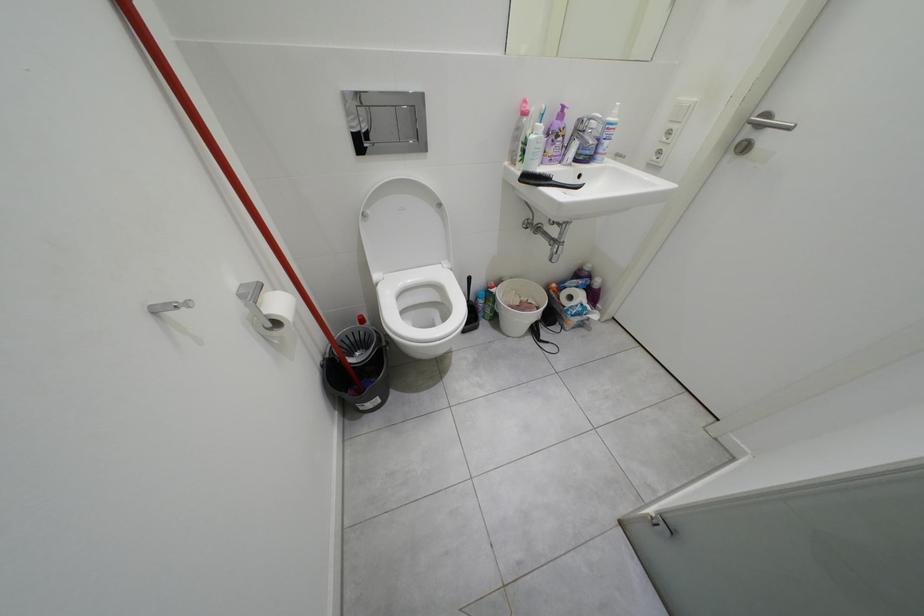
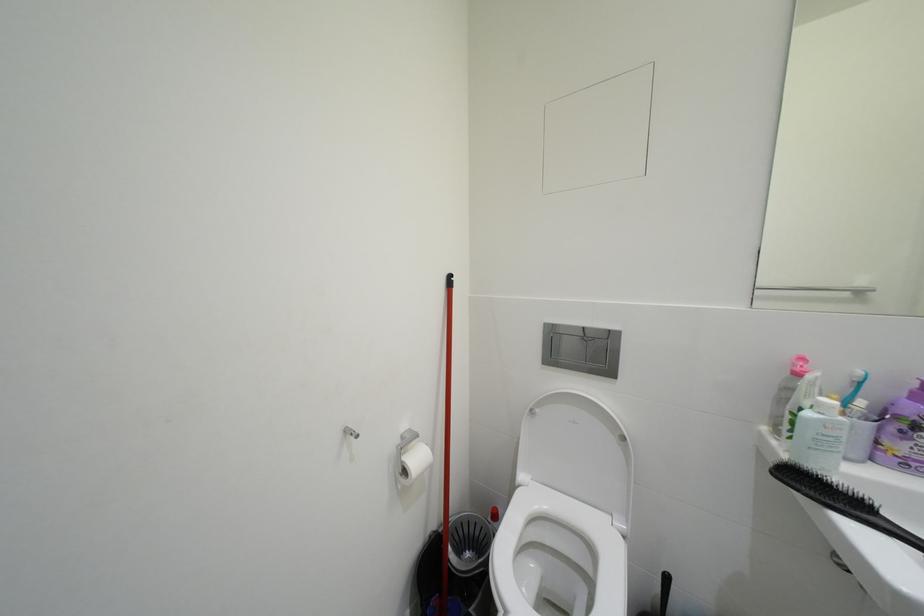
From the picture: First-person continuous shooting, in which direction is the camera rotating?

The camera rotated toward left-up.